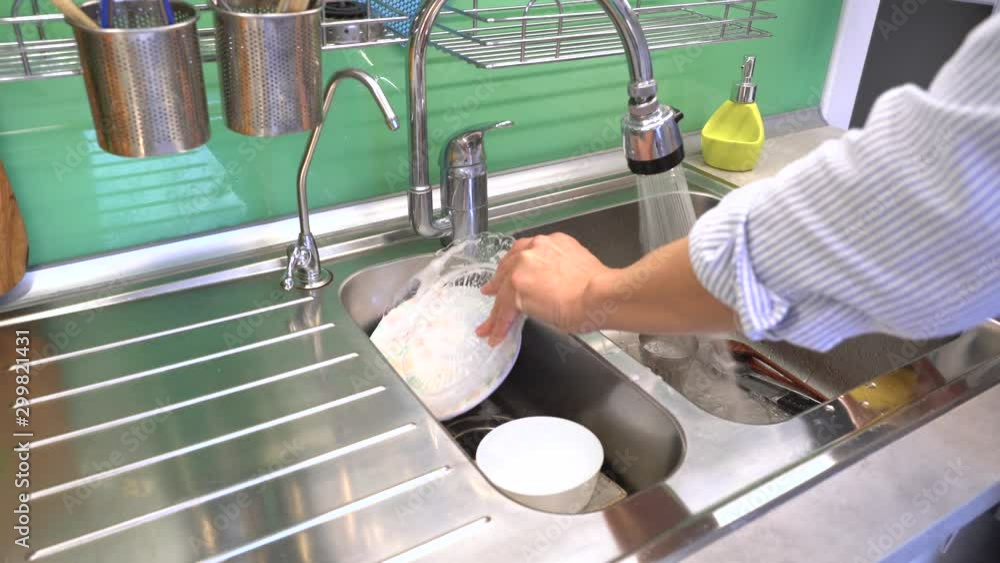
I want to click on sink, so tap(727, 437).